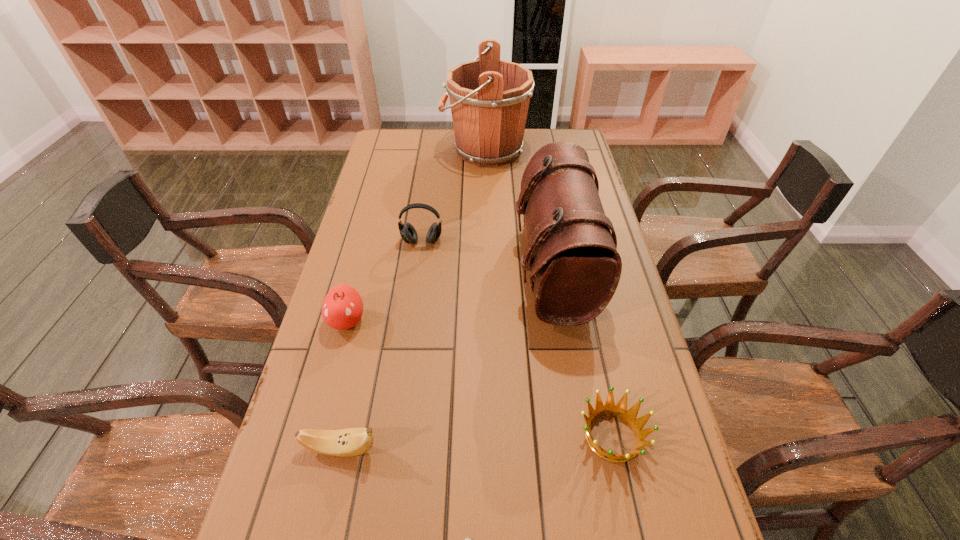
You are a GUI agent. You are given a task and a screenshot of the screen. Output one action in this format:
    pyautogui.click(x=<x>, y=<y>)
    Task: Click on the banana that is at the left edge
    The height and width of the screenshot is (540, 960).
    Given the screenshot: What is the action you would take?
    pyautogui.click(x=349, y=442)

Identify the location of satchel at the right edge. This screenshot has height=540, width=960. (572, 256).

Identify the location of crown that is at the right edge. The width and height of the screenshot is (960, 540). pos(619,410).

I want to click on vacant space at the left edge of the desktop, so click(x=378, y=173).

Image resolution: width=960 pixels, height=540 pixels. I want to click on vacant space at the far left corner of the desktop, so click(x=410, y=132).

Locate an element on the screen. The width and height of the screenshot is (960, 540). vacant space at the far right corner of the desktop is located at coordinates (565, 131).

At what (x,y) coordinates should I click in order to perform the action: click on free space between the apple and the crown. Please return your answer as a coordinate pair (x, y). The height and width of the screenshot is (540, 960). Looking at the image, I should click on (479, 379).

The width and height of the screenshot is (960, 540). What are the coordinates of `free space between the satchel and the crown` in the screenshot? It's located at point(583,353).

In order to click on vacant area that lies between the third tallest object and the bucket in this screenshot , I will do `click(454, 195)`.

Locate an element on the screen. free space that is in between the third tallest object and the crown is located at coordinates (517, 339).